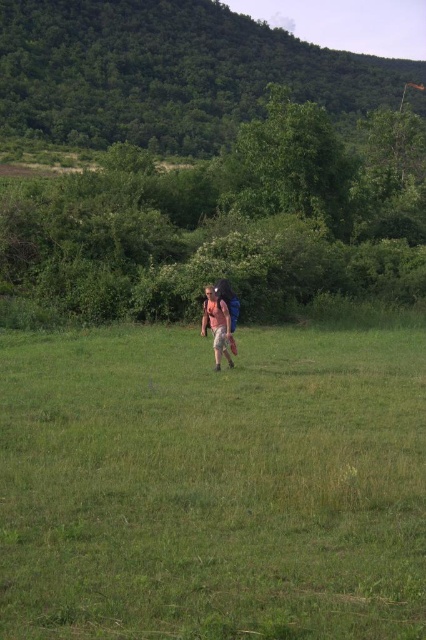
Question: Which is farther from the green leafy hillside at upper center?

Choices:
 (A) light pink fabric backpack at center
 (B) green grass at center

Answer: (A)

Question: Can you confirm if green grass at center is positioned above light pink fabric backpack at center?

Choices:
 (A) yes
 (B) no

Answer: (B)

Question: In this image, where is green leafy hillside at upper center located relative to light pink fabric backpack at center?

Choices:
 (A) left
 (B) right

Answer: (B)

Question: Which of these objects is positioned closest to the green grass at center?

Choices:
 (A) light pink fabric backpack at center
 (B) green leafy hillside at upper center

Answer: (A)

Question: Which is farther from the light pink fabric backpack at center?

Choices:
 (A) green leafy hillside at upper center
 (B) green grass at center

Answer: (A)

Question: Does green leafy hillside at upper center lie in front of light pink fabric backpack at center?

Choices:
 (A) no
 (B) yes

Answer: (A)